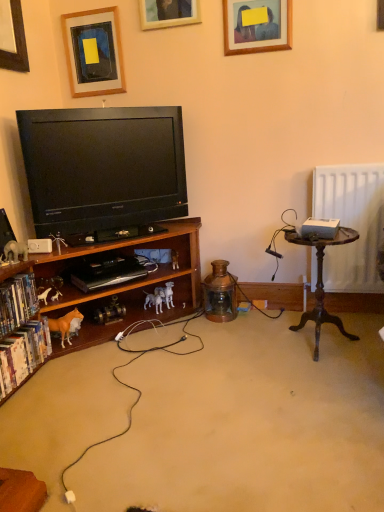
This screenshot has width=384, height=512. Find the location of `vacant space behind wooden vintage table at right`. vacant space behind wooden vintage table at right is located at coordinates (289, 321).